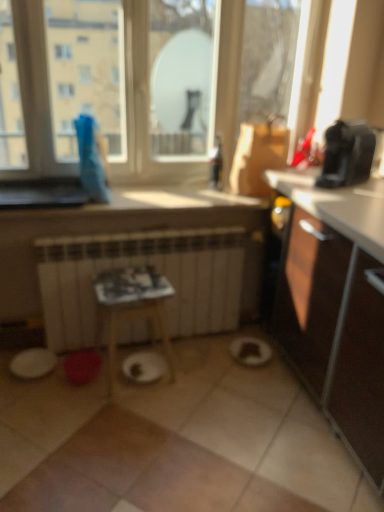
I want to click on vacant space underneath transparent glass window at upper center (from a real-world perspective), so click(154, 182).